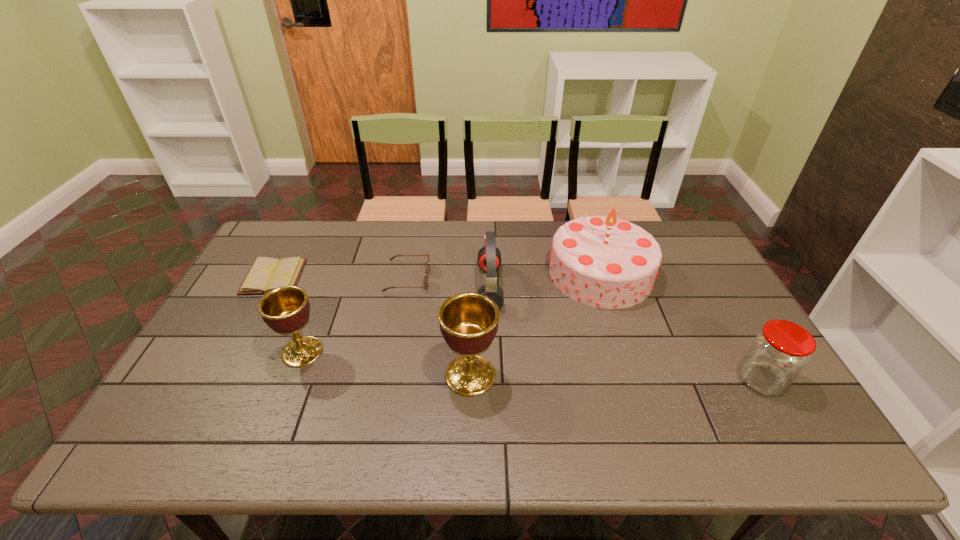
The width and height of the screenshot is (960, 540). Identify the location of birthday cake located at the far edge. (603, 262).

Where is `chalice present at the near edge`? chalice present at the near edge is located at coordinates (468, 321).

Image resolution: width=960 pixels, height=540 pixels. What are the coordinates of `jar that is at the near edge` in the screenshot? It's located at (778, 354).

In order to click on object that is at the left edge in this screenshot , I will do `click(265, 274)`.

What are the coordinates of `object that is positioned at the right edge` in the screenshot? It's located at (778, 354).

In order to click on object at the far left corner in this screenshot , I will do `click(265, 274)`.

This screenshot has height=540, width=960. I want to click on object situated at the near right corner, so click(x=778, y=354).

In the image, there is a desktop. In order to click on vacant space at the far edge in this screenshot , I will do `click(386, 242)`.

Identify the location of blank space at the near edge of the desktop. (668, 406).

In order to click on vacant area at the right edge of the desktop in this screenshot , I will do `click(712, 275)`.